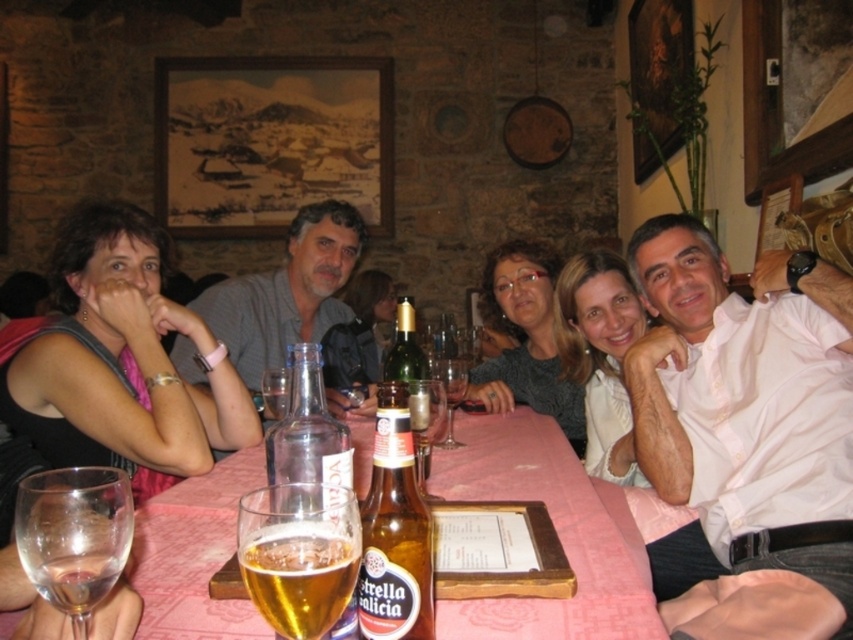
Question: Does pink fabric table at center come behind clear glass bottle at center?

Choices:
 (A) yes
 (B) no

Answer: (A)

Question: Does clear glass bottle at center appear under green glass bottle at center?

Choices:
 (A) no
 (B) yes

Answer: (B)

Question: Among these points, which one is farthest from the camera?

Choices:
 (A) (306, 442)
 (B) (439, 365)
 (C) (375, 438)

Answer: (B)

Question: Does gray matte shirt at center lie in front of clear glass bottle at center?

Choices:
 (A) yes
 (B) no

Answer: (B)

Question: Which object is positioned farthest from the clear glass bottle at center?

Choices:
 (A) transparent glass wine glass at center
 (B) transparent glass at lower left

Answer: (A)

Question: Considering the real-world distances, which object is farthest from the clear glass beer at center?

Choices:
 (A) clear glass bottle at center
 (B) white shirt at right
 (C) amber glass bottle at center
 (D) gray matte shirt at center

Answer: (D)